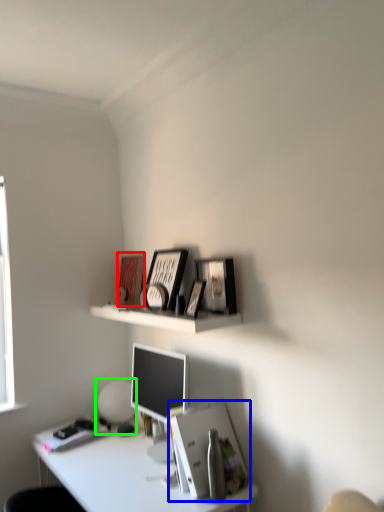
Question: Which object is the farthest from book cover (highlighted by a red box)? Choose among these: paperback book (highlighted by a blue box) or table lamp (highlighted by a green box).

Choices:
 (A) paperback book
 (B) table lamp

Answer: (A)